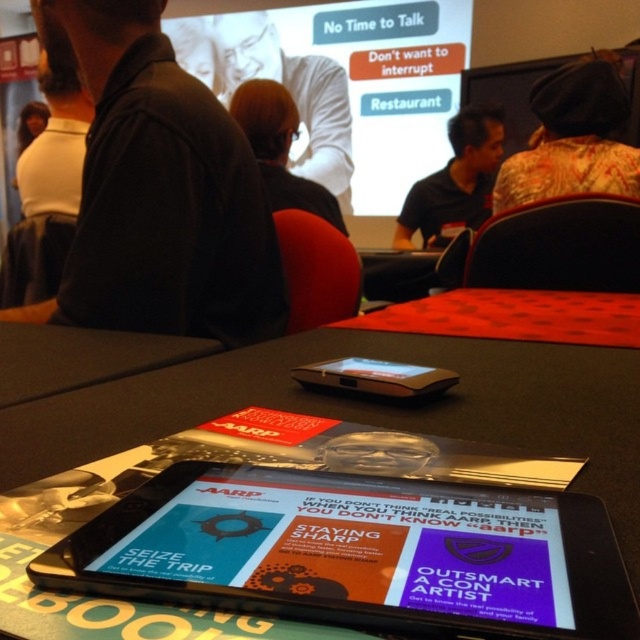
Is black plastic table at center bigger than black plastic tablet at center?

Yes, black plastic table at center is bigger than black plastic tablet at center.

Describe the element at coordinates (32, 339) in the screenshot. The height and width of the screenshot is (640, 640). I see `black plastic table at center` at that location.

Locate an element on the screen. This screenshot has height=640, width=640. black plastic table at center is located at coordinates (32, 339).

This screenshot has width=640, height=640. Describe the element at coordinates (572, 140) in the screenshot. I see `floral fabric shirt at upper right` at that location.

Who is more forward, [625,116] or [432,381]?

Point [432,381]

Who is more forward, (561, 122) or (317, 364)?

Point (317, 364) is in front.

Locate an element on the screen. The width and height of the screenshot is (640, 640). floral fabric shirt at upper right is located at coordinates (572, 140).

This screenshot has width=640, height=640. What do you see at coordinates (572, 140) in the screenshot?
I see `floral fabric shirt at upper right` at bounding box center [572, 140].

Is point (554, 177) closer to viewer compared to point (64, 49)?

No.

Identify the location of floral fabric shirt at upper right. (572, 140).